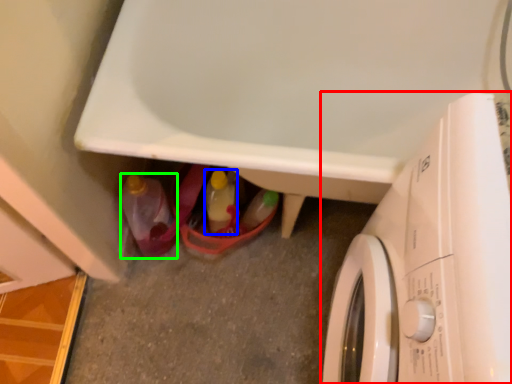
Question: Which is nearer to the washing machine (highlighted by a red box)? bottle (highlighted by a blue box) or bottle (highlighted by a green box).

Choices:
 (A) bottle
 (B) bottle

Answer: (A)